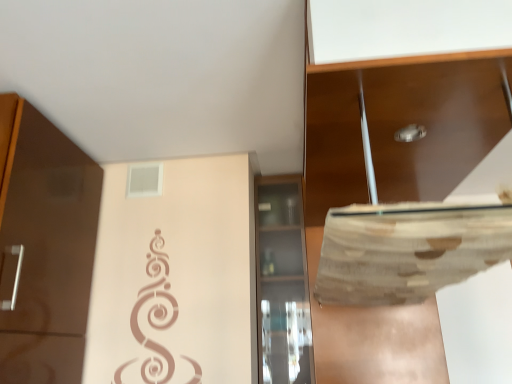
Question: Choose the correct answer: Is transparent glass cabinet at center, which appears as the 1th cabinetry when ordered from the bottom, inside matte brown cabinet at upper right, which is the 2th cabinetry in bottom-to-top order, or outside it?

Choices:
 (A) outside
 (B) inside

Answer: (A)

Question: Is point (278, 360) closer or farther from the camera than point (366, 92)?

Choices:
 (A) closer
 (B) farther

Answer: (B)

Question: Is transparent glass cabinet at center, which appears as the 1th cabinetry when ordered from the bottom, wider or thinner than matte brown cabinet at upper right, which is the 2th cabinetry in bottom-to-top order?

Choices:
 (A) thin
 (B) wide

Answer: (A)

Question: Considering the positions of point tap(380, 165) and point tap(261, 193), is point tap(380, 165) closer or farther from the camera than point tap(261, 193)?

Choices:
 (A) closer
 (B) farther

Answer: (A)

Question: From a real-world perspective, relative to transparent glass cabinet at center, marked as the second cabinetry in a top-to-bottom arrangement, is matte brown cabinet at upper right, which is counted as the first cabinetry, starting from the top, vertically above or below?

Choices:
 (A) above
 (B) below

Answer: (A)

Question: In terms of width, does matte brown cabinet at upper right, which is counted as the first cabinetry, starting from the top, look wider or thinner when compared to transparent glass cabinet at center, marked as the second cabinetry in a top-to-bottom arrangement?

Choices:
 (A) wide
 (B) thin

Answer: (A)

Question: Based on their sizes in the image, would you say matte brown cabinet at upper right, which is counted as the first cabinetry, starting from the top, is bigger or smaller than transparent glass cabinet at center, marked as the second cabinetry in a top-to-bottom arrangement?

Choices:
 (A) big
 (B) small

Answer: (A)